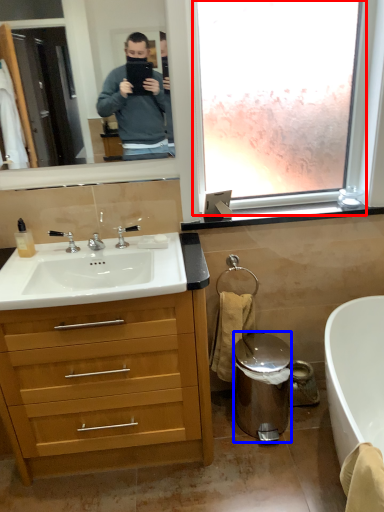
Question: Which of the following is the farthest to the observer, window frame (highlighted by a red box) or trash bin/can (highlighted by a blue box)?

Choices:
 (A) window frame
 (B) trash bin/can

Answer: (B)